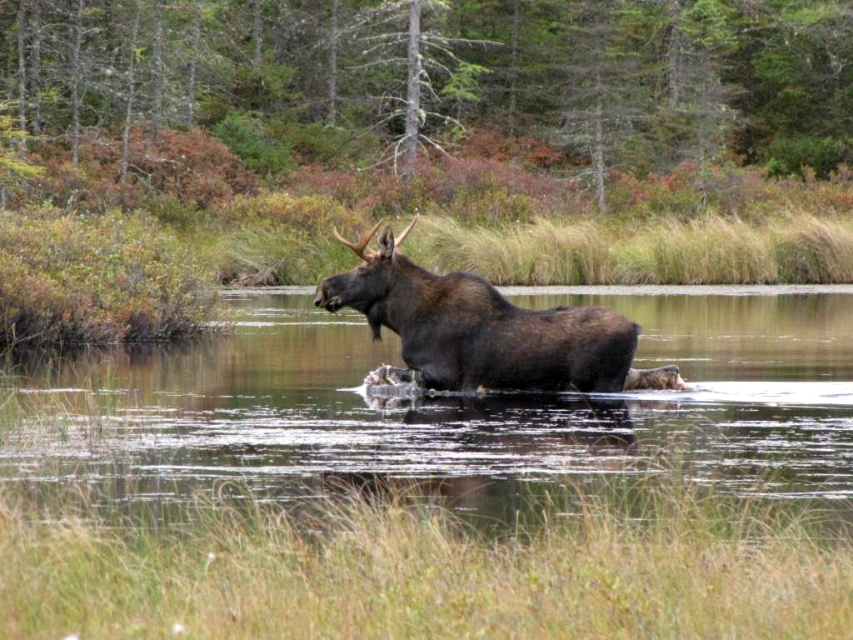
Question: Among these points, which one is farthest from the camera?

Choices:
 (A) (796, 412)
 (B) (463, 364)

Answer: (A)

Question: Observing the image, what is the correct spatial positioning of brown water at center in reference to brown furry moose at center?

Choices:
 (A) left
 (B) right

Answer: (A)

Question: Which point is closer to the camera taking this photo?

Choices:
 (A) (375, 465)
 (B) (393, 320)

Answer: (A)

Question: Does brown water at center have a smaller size compared to brown furry moose at center?

Choices:
 (A) no
 (B) yes

Answer: (A)

Question: In this image, where is brown water at center located relative to brown furry moose at center?

Choices:
 (A) below
 (B) above

Answer: (A)